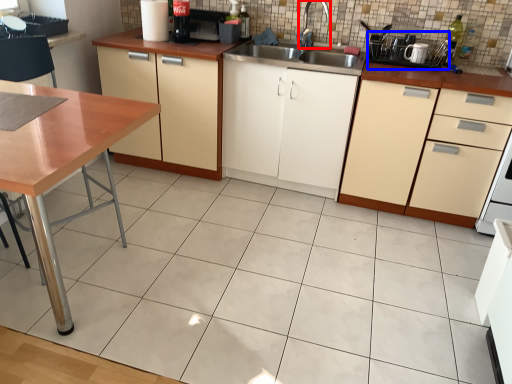
Question: Which point is further to the camera, faucet (highlighted by a red box) or appliance (highlighted by a blue box)?

Choices:
 (A) faucet
 (B) appliance

Answer: (A)